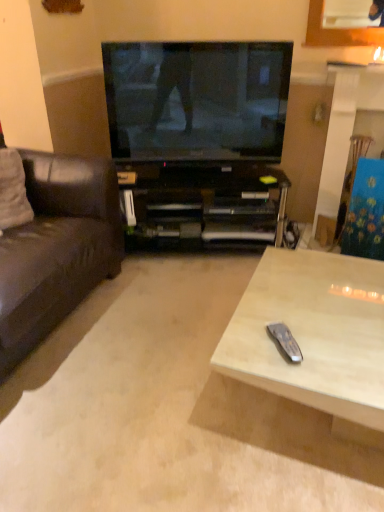
Question: Considering the positions of silver metallic remote at lower right and black plastic cabinet at center in the image, is silver metallic remote at lower right bigger or smaller than black plastic cabinet at center?

Choices:
 (A) small
 (B) big

Answer: (A)

Question: Relative to black plastic cabinet at center, is silver metallic remote at lower right in front or behind?

Choices:
 (A) front
 (B) behind

Answer: (A)

Question: Which of these objects is positioned closest to the light wood/texture remote control at lower right?

Choices:
 (A) silver metallic remote at lower right
 (B) matte black tv at center
 (C) black plastic cabinet at center
 (D) white fabric pillow at left
 (E) wooden coffee table at center

Answer: (A)

Question: Estimate the real-world distances between objects in this image. Which object is closer to the black plastic cabinet at center?

Choices:
 (A) silver metallic remote at lower right
 (B) matte black tv at center
 (C) brown leather couch at left
 (D) white fabric pillow at left
 (E) light wood/texture remote control at lower right

Answer: (B)